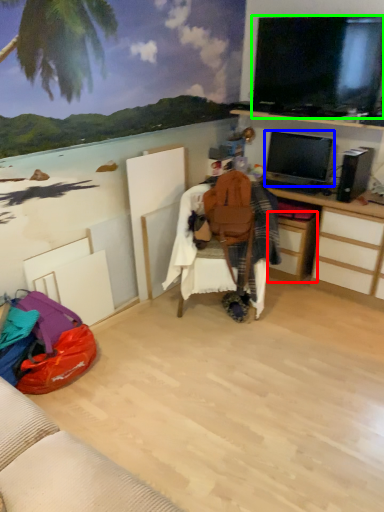
Question: Considering the real-world distances, which object is farthest from drawer (highlighted by a red box)? television (highlighted by a blue box) or television (highlighted by a green box)?

Choices:
 (A) television
 (B) television

Answer: (B)